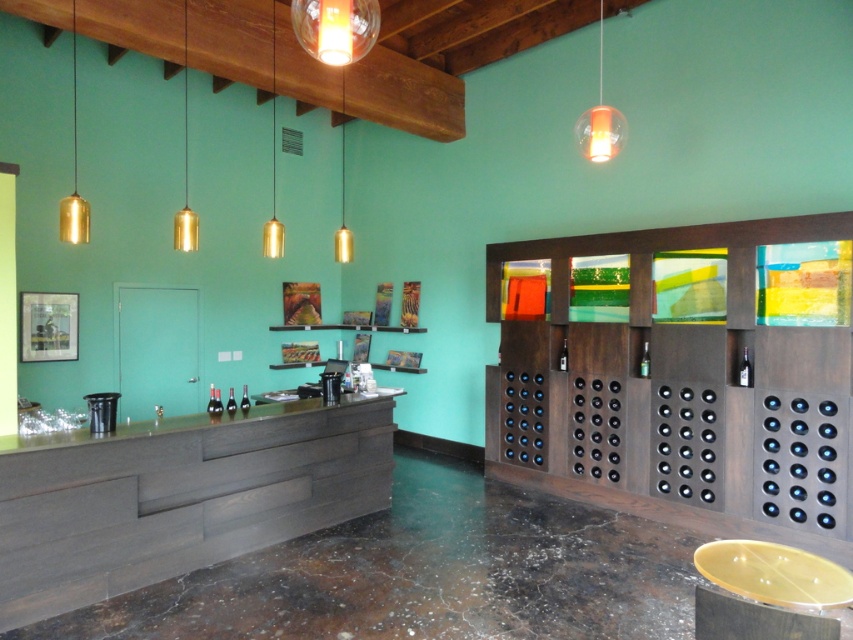
Question: Can you confirm if dark wood counter at center is wider than translucent orange glass pendant light at upper right?

Choices:
 (A) no
 (B) yes

Answer: (B)

Question: Estimate the real-world distances between objects in this image. Which object is closer to the dark wood counter at center?

Choices:
 (A) smooth wood counter at center
 (B) translucent orange glass pendant light at upper right

Answer: (A)

Question: Is dark wood counter at center to the right of translucent orange glass pendant light at upper right from the viewer's perspective?

Choices:
 (A) no
 (B) yes

Answer: (A)

Question: Among these objects, which one is nearest to the camera?

Choices:
 (A) translucent orange glass pendant light at upper right
 (B) smooth wood counter at center

Answer: (B)

Question: Can you confirm if dark wood counter at center is positioned to the left of smooth wood counter at center?

Choices:
 (A) yes
 (B) no

Answer: (B)

Question: Which object appears farthest from the camera in this image?

Choices:
 (A) translucent orange glass pendant light at upper right
 (B) dark wood counter at center
 (C) smooth wood counter at center

Answer: (A)